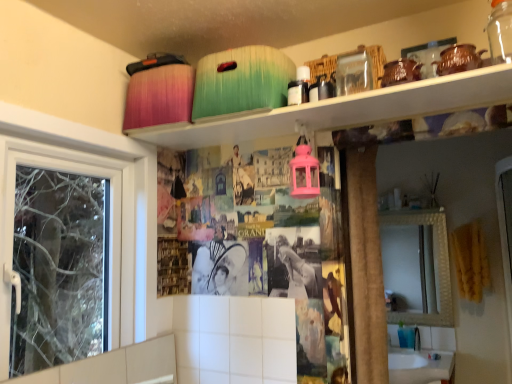
Question: Is white glossy sink at lower right positioned with its back to matte plastic containers at upper center?

Choices:
 (A) no
 (B) yes

Answer: (A)

Question: Is white glossy sink at lower right wider than matte plastic containers at upper center?

Choices:
 (A) yes
 (B) no

Answer: (A)

Question: From the image's perspective, is white glossy sink at lower right located above matte plastic containers at upper center?

Choices:
 (A) yes
 (B) no

Answer: (B)

Question: Can you confirm if white glossy sink at lower right is taller than matte plastic containers at upper center?

Choices:
 (A) yes
 (B) no

Answer: (A)

Question: Can you confirm if white glossy sink at lower right is bigger than matte plastic containers at upper center?

Choices:
 (A) no
 (B) yes

Answer: (B)

Question: Is white glossy sink at lower right aimed at matte plastic containers at upper center?

Choices:
 (A) no
 (B) yes

Answer: (A)

Question: From the image's perspective, does matte plastic containers at upper center appear higher than white glossy sink at lower right?

Choices:
 (A) no
 (B) yes

Answer: (B)

Question: Would you say white glossy sink at lower right is part of matte plastic containers at upper center's contents?

Choices:
 (A) no
 (B) yes

Answer: (A)

Question: Is matte plastic containers at upper center to the left of white glossy sink at lower right from the viewer's perspective?

Choices:
 (A) yes
 (B) no

Answer: (A)

Question: Could you tell me if matte plastic containers at upper center is turned towards white glossy sink at lower right?

Choices:
 (A) yes
 (B) no

Answer: (B)

Question: Is matte plastic containers at upper center wider than white glossy sink at lower right?

Choices:
 (A) no
 (B) yes

Answer: (A)

Question: From a real-world perspective, is matte plastic containers at upper center over white glossy sink at lower right?

Choices:
 (A) no
 (B) yes

Answer: (B)

Question: Is transparent glass jar at upper center further to camera compared to matte plastic containers at upper center?

Choices:
 (A) no
 (B) yes

Answer: (B)